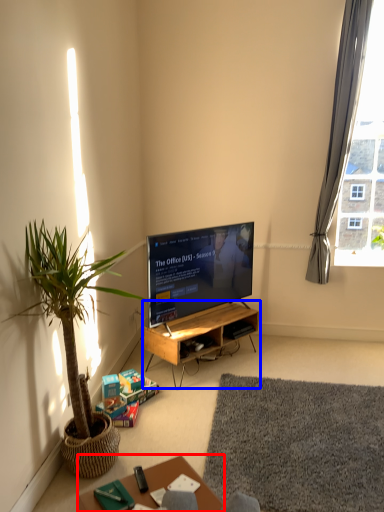
Question: Which object appears closest to the camera in this image, table (highlighted by a red box) or desk (highlighted by a blue box)?

Choices:
 (A) table
 (B) desk

Answer: (A)